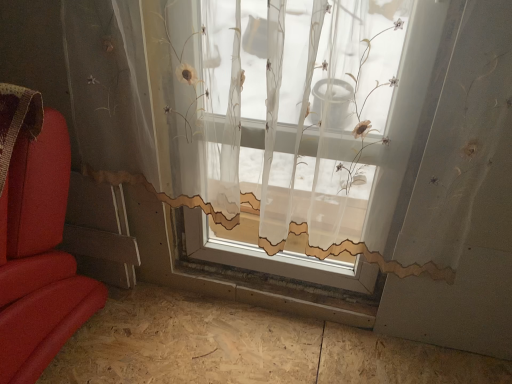
Question: From a real-world perspective, is translucent fabric window at center over light brown plywood at lower left?

Choices:
 (A) no
 (B) yes

Answer: (B)

Question: Considering the relative sizes of translucent fabric window at center and light brown plywood at lower left in the image provided, is translucent fabric window at center wider than light brown plywood at lower left?

Choices:
 (A) yes
 (B) no

Answer: (B)

Question: Considering the relative sizes of translucent fabric window at center and light brown plywood at lower left in the image provided, is translucent fabric window at center thinner than light brown plywood at lower left?

Choices:
 (A) no
 (B) yes

Answer: (B)

Question: Could light brown plywood at lower left be considered to be inside translucent fabric window at center?

Choices:
 (A) yes
 (B) no

Answer: (B)

Question: From the image's perspective, is translucent fabric window at center on top of light brown plywood at lower left?

Choices:
 (A) yes
 (B) no

Answer: (A)

Question: Is translucent fabric window at center aimed at light brown plywood at lower left?

Choices:
 (A) yes
 (B) no

Answer: (B)

Question: Is translucent fabric window at center a part of light brown plywood at lower left?

Choices:
 (A) no
 (B) yes

Answer: (A)

Question: Considering the relative sizes of light brown plywood at lower left and translucent fabric window at center in the image provided, is light brown plywood at lower left shorter than translucent fabric window at center?

Choices:
 (A) no
 (B) yes

Answer: (B)

Question: Does light brown plywood at lower left have a greater width compared to translucent fabric window at center?

Choices:
 (A) yes
 (B) no

Answer: (A)

Question: Is light brown plywood at lower left positioned with its back to translucent fabric window at center?

Choices:
 (A) no
 (B) yes

Answer: (A)

Question: Is light brown plywood at lower left oriented towards translucent fabric window at center?

Choices:
 (A) no
 (B) yes

Answer: (A)

Question: From a real-world perspective, is light brown plywood at lower left physically below translucent fabric window at center?

Choices:
 (A) yes
 (B) no

Answer: (A)

Question: Is point (486, 49) positioned closer to the camera than point (398, 354)?

Choices:
 (A) closer
 (B) farther

Answer: (A)